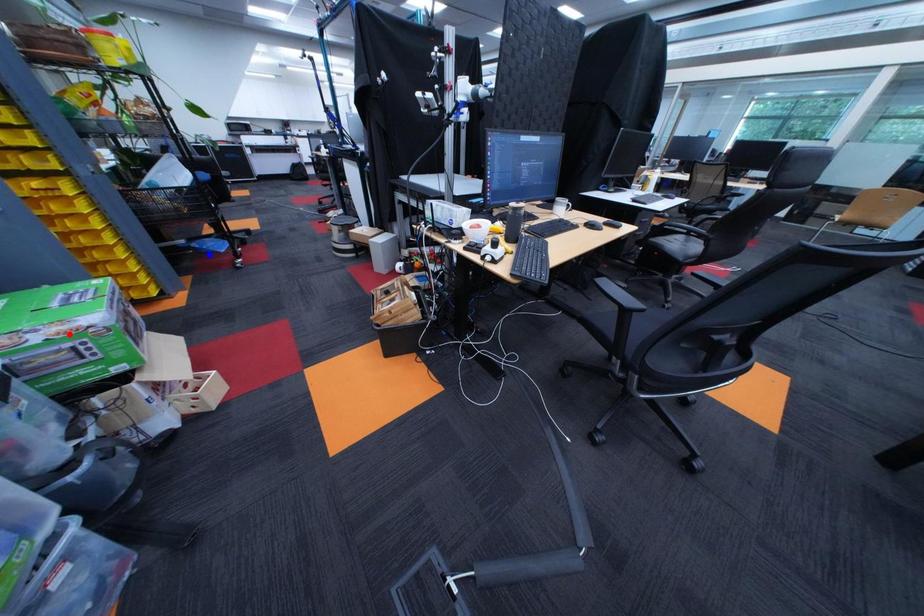
Question: Which of the two points in the image is closer to the camera?

Choices:
 (A) Blue point is closer.
 (B) Red point is closer.

Answer: (B)